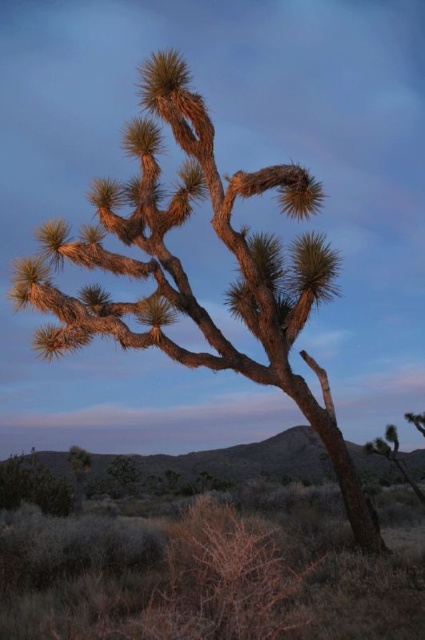
Question: Which object is positioned farthest from the brown rough bark tree at center?

Choices:
 (A) brown rough bark tree at lower right
 (B) brown rough bark tree at lower left

Answer: (B)

Question: Does brown rough bark tree at center appear on the right side of brown rough bark tree at lower right?

Choices:
 (A) no
 (B) yes

Answer: (A)

Question: Which point is farther to the camera?

Choices:
 (A) (419, 499)
 (B) (317, 420)

Answer: (A)

Question: Which point is closer to the camera?

Choices:
 (A) brown rough bark tree at lower right
 (B) brown rough bark tree at lower left

Answer: (A)

Question: Can you confirm if brown rough bark tree at center is thinner than brown rough bark tree at lower left?

Choices:
 (A) no
 (B) yes

Answer: (B)

Question: Considering the relative positions of brown rough bark tree at center and brown rough bark tree at lower left in the image provided, where is brown rough bark tree at center located with respect to brown rough bark tree at lower left?

Choices:
 (A) below
 (B) above

Answer: (B)